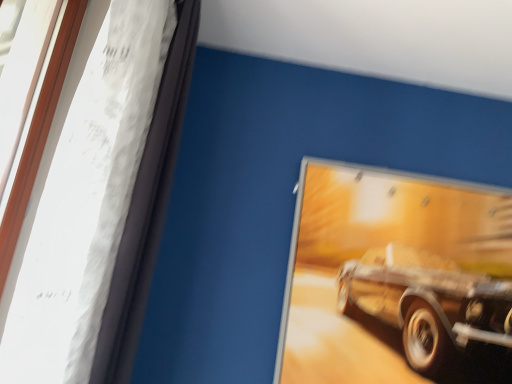
Question: Considering the positions of wooden frame at left and metallic gold car at upper right in the image, is wooden frame at left wider or thinner than metallic gold car at upper right?

Choices:
 (A) thin
 (B) wide

Answer: (B)

Question: In the image, is wooden frame at left on the left side or the right side of metallic gold car at upper right?

Choices:
 (A) left
 (B) right

Answer: (A)

Question: Is wooden frame at left in front of or behind metallic gold car at upper right in the image?

Choices:
 (A) behind
 (B) front

Answer: (B)

Question: Would you say metallic gold car at upper right is inside or outside wooden frame at left?

Choices:
 (A) outside
 (B) inside

Answer: (A)

Question: Is metallic gold car at upper right in front of or behind wooden frame at left in the image?

Choices:
 (A) behind
 (B) front

Answer: (A)

Question: In terms of height, does metallic gold car at upper right look taller or shorter compared to wooden frame at left?

Choices:
 (A) short
 (B) tall

Answer: (A)

Question: Is point (425, 185) closer or farther from the camera than point (60, 246)?

Choices:
 (A) closer
 (B) farther

Answer: (B)